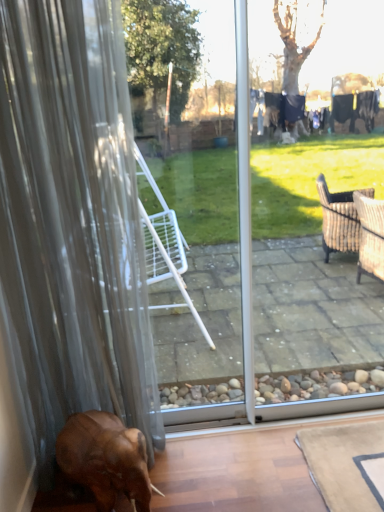
Question: Is the position of brown matte elephant at lower left less distant than that of translucent fabric curtain at left?

Choices:
 (A) yes
 (B) no

Answer: (B)

Question: From a real-world perspective, is brown matte elephant at lower left on translucent fabric curtain at left?

Choices:
 (A) yes
 (B) no

Answer: (B)

Question: From the image's perspective, is brown matte elephant at lower left under translucent fabric curtain at left?

Choices:
 (A) no
 (B) yes

Answer: (B)

Question: Can we say brown matte elephant at lower left lies outside translucent fabric curtain at left?

Choices:
 (A) no
 (B) yes

Answer: (A)

Question: From a real-world perspective, is brown matte elephant at lower left physically below translucent fabric curtain at left?

Choices:
 (A) yes
 (B) no

Answer: (A)

Question: Considering the relative sizes of brown matte elephant at lower left and translucent fabric curtain at left in the image provided, is brown matte elephant at lower left taller than translucent fabric curtain at left?

Choices:
 (A) yes
 (B) no

Answer: (B)

Question: From the image's perspective, is translucent fabric curtain at left below brown matte elephant at lower left?

Choices:
 (A) no
 (B) yes

Answer: (A)

Question: Considering the relative sizes of translucent fabric curtain at left and brown matte elephant at lower left in the image provided, is translucent fabric curtain at left shorter than brown matte elephant at lower left?

Choices:
 (A) no
 (B) yes

Answer: (A)

Question: Is brown matte elephant at lower left surrounded by translucent fabric curtain at left?

Choices:
 (A) yes
 (B) no

Answer: (A)

Question: Is translucent fabric curtain at left not near brown matte elephant at lower left?

Choices:
 (A) yes
 (B) no

Answer: (B)

Question: Does translucent fabric curtain at left lie behind brown matte elephant at lower left?

Choices:
 (A) no
 (B) yes

Answer: (A)

Question: Is translucent fabric curtain at left outside brown matte elephant at lower left?

Choices:
 (A) no
 (B) yes

Answer: (B)

Question: In the image, is translucent fabric curtain at left on the left side or the right side of brown matte elephant at lower left?

Choices:
 (A) left
 (B) right

Answer: (A)